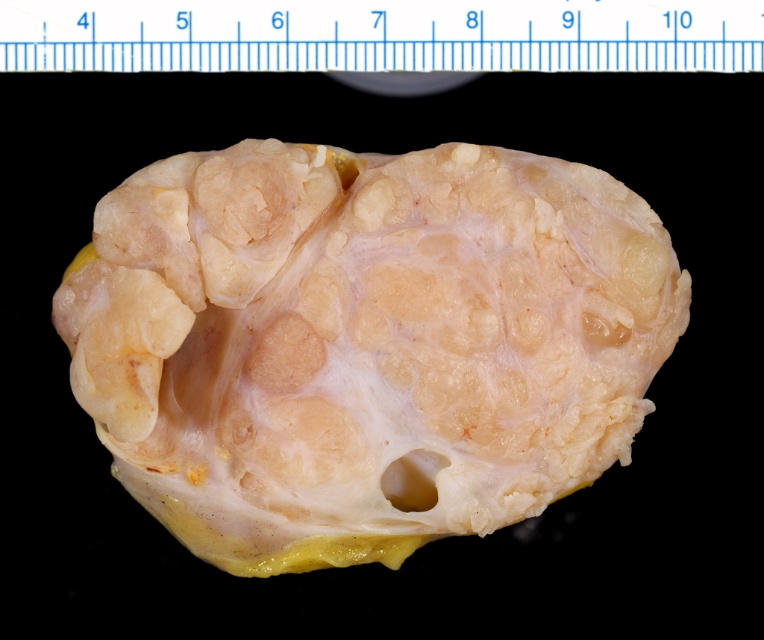
Question: Is translucent yellowish flesh at center thinner than white plastic ruler at upper center?

Choices:
 (A) no
 (B) yes

Answer: (B)

Question: Does translucent yellowish flesh at center have a greater width compared to white plastic ruler at upper center?

Choices:
 (A) no
 (B) yes

Answer: (A)

Question: Which point is farther from the camera taking this photo?

Choices:
 (A) (413, 44)
 (B) (164, 284)

Answer: (A)

Question: Can you confirm if translucent yellowish flesh at center is smaller than white plastic ruler at upper center?

Choices:
 (A) no
 (B) yes

Answer: (A)

Question: Which object is closer to the camera taking this photo?

Choices:
 (A) translucent yellowish flesh at center
 (B) white plastic ruler at upper center

Answer: (A)